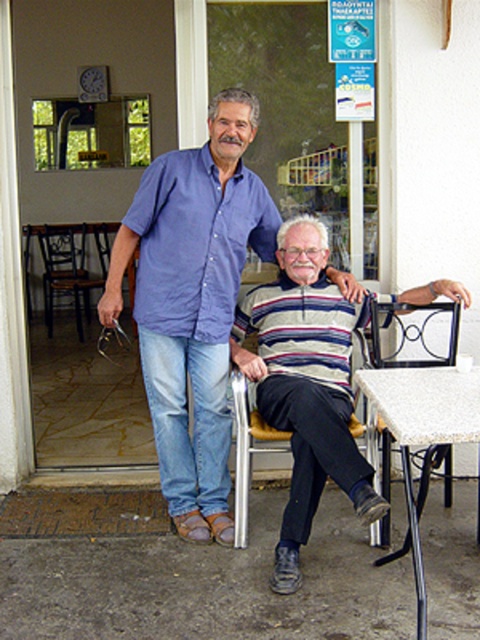
Can you confirm if striped knitwear at center is thinner than white laminate table at lower right?

In fact, striped knitwear at center might be wider than white laminate table at lower right.

Which of these two, striped knitwear at center or white laminate table at lower right, stands shorter?

Standing shorter between the two is white laminate table at lower right.

The height and width of the screenshot is (640, 480). What do you see at coordinates (305, 385) in the screenshot?
I see `striped knitwear at center` at bounding box center [305, 385].

At what (x,y) coordinates should I click in order to perform the action: click on striped knitwear at center. Please return your answer as a coordinate pair (x, y). This screenshot has height=640, width=480. Looking at the image, I should click on (305, 385).

Who is higher up, white laminate table at lower right or metallic frame chair at lower right?

metallic frame chair at lower right is higher up.

Measure the distance between point (408,426) and camera.

Point (408,426) is 7.41 feet from camera.

The width and height of the screenshot is (480, 640). Describe the element at coordinates (422, 429) in the screenshot. I see `white laminate table at lower right` at that location.

This screenshot has height=640, width=480. I want to click on white laminate table at lower right, so click(x=422, y=429).

Can you confirm if matte blue shirt at center is shorter than white laminate table at lower right?

Yes.

Image resolution: width=480 pixels, height=640 pixels. I want to click on matte blue shirt at center, so click(195, 243).